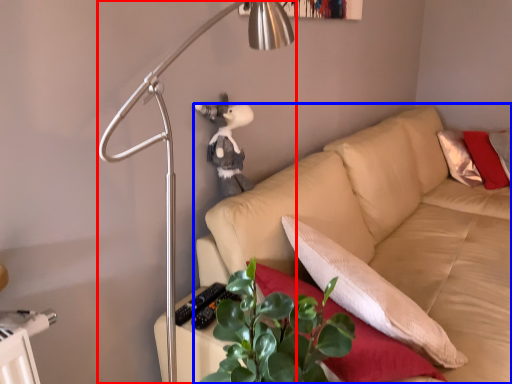
Question: Which object appears closest to the camera in this image, lamp (highlighted by a red box) or studio couch (highlighted by a blue box)?

Choices:
 (A) lamp
 (B) studio couch

Answer: (A)